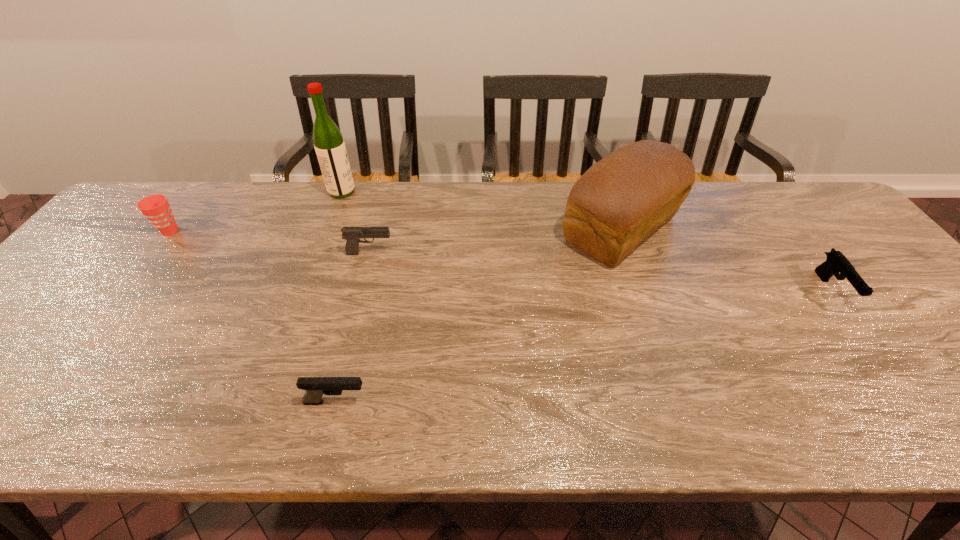
You are a GUI agent. You are given a task and a screenshot of the screen. Output one action in this format:
    pyautogui.click(x=<x>, y=<y>)
    Task: Click on the liquor
    Image resolution: width=960 pixels, height=540 pixels.
    Given the screenshot: What is the action you would take?
    pyautogui.click(x=329, y=145)

Where is `the tallest object`? the tallest object is located at coordinates (329, 145).

Identify the location of the second tallest object. The height and width of the screenshot is (540, 960). (618, 202).

This screenshot has width=960, height=540. I want to click on bread, so click(618, 202).

This screenshot has height=540, width=960. In order to click on the leftmost object in this screenshot , I will do `click(156, 208)`.

Find the location of a particular element. The width and height of the screenshot is (960, 540). the farthest pistol is located at coordinates (351, 234).

The height and width of the screenshot is (540, 960). Identify the location of the rightmost object. (836, 262).

Image resolution: width=960 pixels, height=540 pixels. I want to click on the rightmost pistol, so click(836, 262).

In order to click on the nearest pistol in this screenshot , I will do `click(315, 387)`.

I want to click on vacant space located on the label of the tallest object, so click(412, 192).